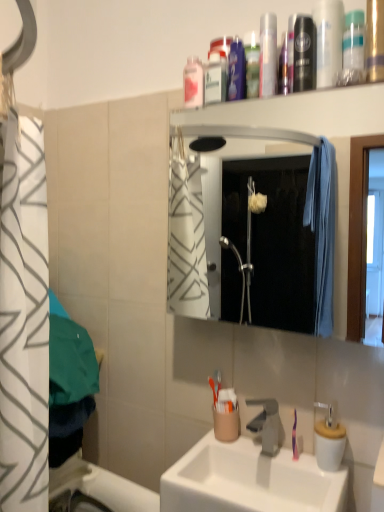
Question: Can you confirm if white ceramic sink at center is positioned to the left of metallic silver mouthwash at upper center, the 2th mouthwash viewed from the right?

Choices:
 (A) yes
 (B) no

Answer: (A)

Question: Does white ceramic sink at center have a greater height compared to metallic silver mouthwash at upper center, the 3th mouthwash positioned from the left?

Choices:
 (A) no
 (B) yes

Answer: (B)

Question: Is white ceramic sink at center beside metallic silver mouthwash at upper center, the 2th mouthwash viewed from the right?

Choices:
 (A) no
 (B) yes

Answer: (A)

Question: Considering the relative sizes of white ceramic sink at center and metallic silver mouthwash at upper center, the 4th mouthwash viewed from the back, in the image provided, is white ceramic sink at center shorter than metallic silver mouthwash at upper center, the 4th mouthwash viewed from the back,?

Choices:
 (A) yes
 (B) no

Answer: (B)

Question: From the image's perspective, is white ceramic sink at center over metallic silver mouthwash at upper center, the 4th mouthwash viewed from the back?

Choices:
 (A) no
 (B) yes

Answer: (A)

Question: Considering the positions of translucent plastic mouthwash at upper center, which ranks as the 3th mouthwash in right-to-left order, and metallic silver canister at upper right in the image, is translucent plastic mouthwash at upper center, which ranks as the 3th mouthwash in right-to-left order, taller or shorter than metallic silver canister at upper right?

Choices:
 (A) tall
 (B) short

Answer: (B)

Question: From the image's perspective, relative to metallic silver canister at upper right, is translucent plastic mouthwash at upper center, placed as the 3th mouthwash when sorted from front to back, above or below?

Choices:
 (A) above
 (B) below

Answer: (B)

Question: Would you say translucent plastic mouthwash at upper center, which is the 2th mouthwash from left to right, is inside or outside metallic silver canister at upper right?

Choices:
 (A) outside
 (B) inside

Answer: (A)

Question: Considering the positions of translucent plastic mouthwash at upper center, which is the 2th mouthwash from left to right, and metallic silver canister at upper right in the image, is translucent plastic mouthwash at upper center, which is the 2th mouthwash from left to right, bigger or smaller than metallic silver canister at upper right?

Choices:
 (A) small
 (B) big

Answer: (A)

Question: Based on their sizes in the image, would you say pink plastic mouthwash at upper center, marked as the 1th mouthwash in a back-to-front arrangement, is bigger or smaller than satin nickel faucet at sink center?

Choices:
 (A) small
 (B) big

Answer: (A)

Question: In terms of height, does pink plastic mouthwash at upper center, arranged as the fourth mouthwash when viewed from the front, look taller or shorter compared to satin nickel faucet at sink center?

Choices:
 (A) short
 (B) tall

Answer: (B)

Question: Is pink plastic mouthwash at upper center, which is counted as the fourth mouthwash, starting from the right, situated inside satin nickel faucet at sink center or outside?

Choices:
 (A) outside
 (B) inside

Answer: (A)

Question: In the image, is pink plastic mouthwash at upper center, arranged as the fourth mouthwash when viewed from the front, positioned in front of or behind satin nickel faucet at sink center?

Choices:
 (A) front
 (B) behind

Answer: (B)

Question: Which is correct: translucent plastic mouthwash at upper center, arranged as the second mouthwash when viewed from the back, is inside pink plastic mouthwash at upper center, marked as the 1th mouthwash in a back-to-front arrangement, or outside of it?

Choices:
 (A) inside
 (B) outside

Answer: (B)

Question: In terms of height, does translucent plastic mouthwash at upper center, which ranks as the 3th mouthwash in right-to-left order, look taller or shorter compared to pink plastic mouthwash at upper center, which is counted as the fourth mouthwash, starting from the right?

Choices:
 (A) tall
 (B) short

Answer: (A)